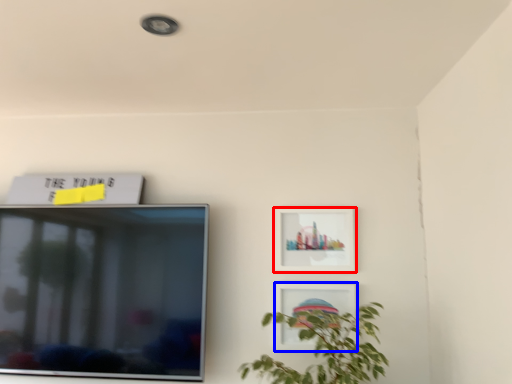
Question: Which object appears farthest to the camera in this image, picture frame (highlighted by a red box) or picture frame (highlighted by a blue box)?

Choices:
 (A) picture frame
 (B) picture frame

Answer: (A)